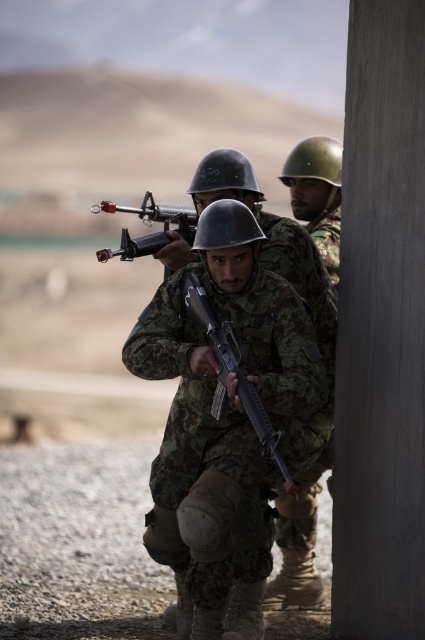
Question: Observing the image, what is the correct spatial positioning of camouflage fabric rifle at center in reference to matte black rifle at center?

Choices:
 (A) above
 (B) below

Answer: (B)

Question: Does camouflage fabric rifle at center appear under matte black rifle at center?

Choices:
 (A) yes
 (B) no

Answer: (A)

Question: Is camouflage fabric rifle at center to the left of matte black rifle at center from the viewer's perspective?

Choices:
 (A) yes
 (B) no

Answer: (B)

Question: Which of the following is the farthest from the observer?

Choices:
 (A) camouflage fabric rifle at center
 (B) matte black rifle at center

Answer: (A)